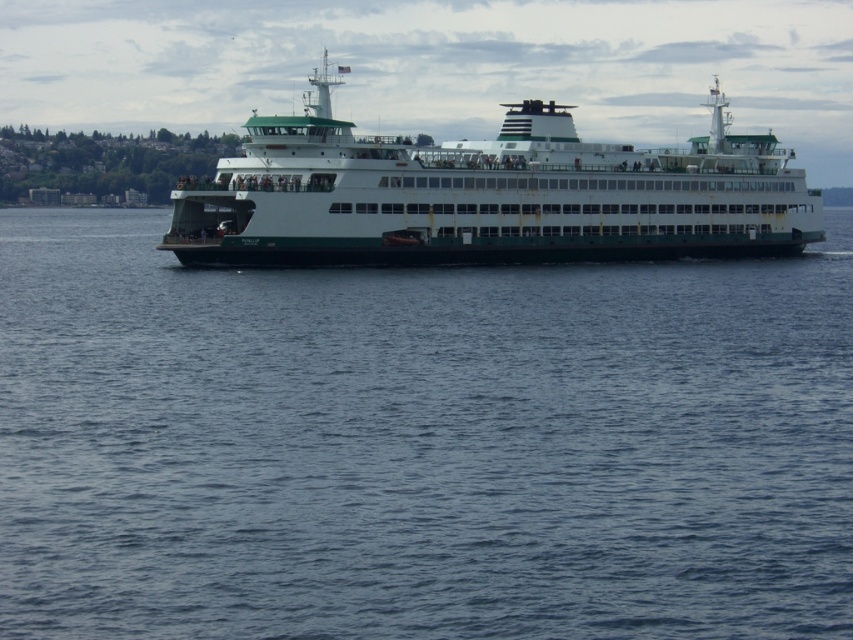
Question: Which point is closer to the camera taking this photo?

Choices:
 (A) (512, 179)
 (B) (824, 490)

Answer: (B)

Question: Is blue water at center smaller than white matte ferry at center?

Choices:
 (A) no
 (B) yes

Answer: (B)

Question: From the image, what is the correct spatial relationship of blue water at center in relation to white matte ferry at center?

Choices:
 (A) below
 (B) above

Answer: (A)

Question: Which point is closer to the camera taking this photo?

Choices:
 (A) (613, 221)
 (B) (231, 582)

Answer: (B)

Question: Which of the following is the farthest from the observer?

Choices:
 (A) (672, 484)
 (B) (408, 228)

Answer: (B)

Question: Does blue water at center have a greater width compared to white matte ferry at center?

Choices:
 (A) yes
 (B) no

Answer: (B)